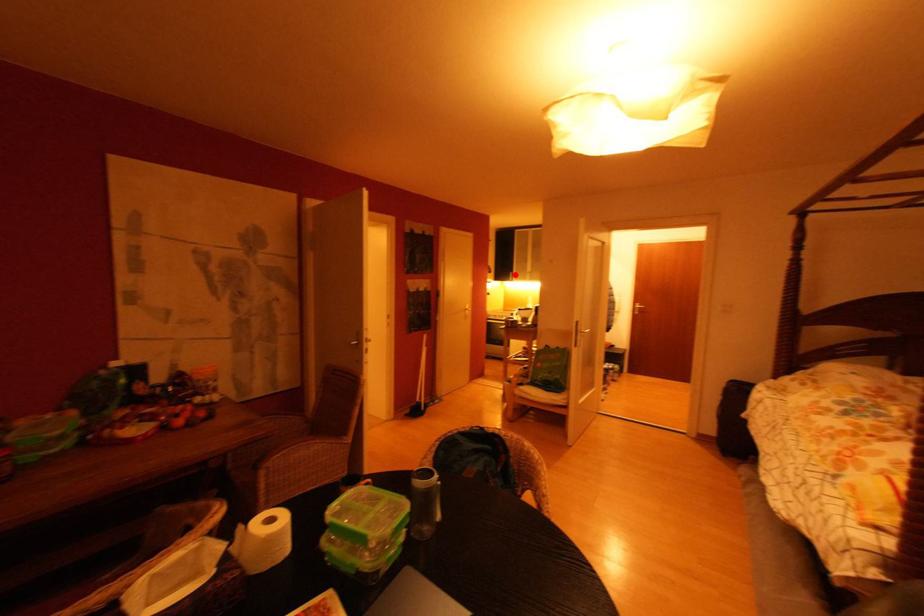
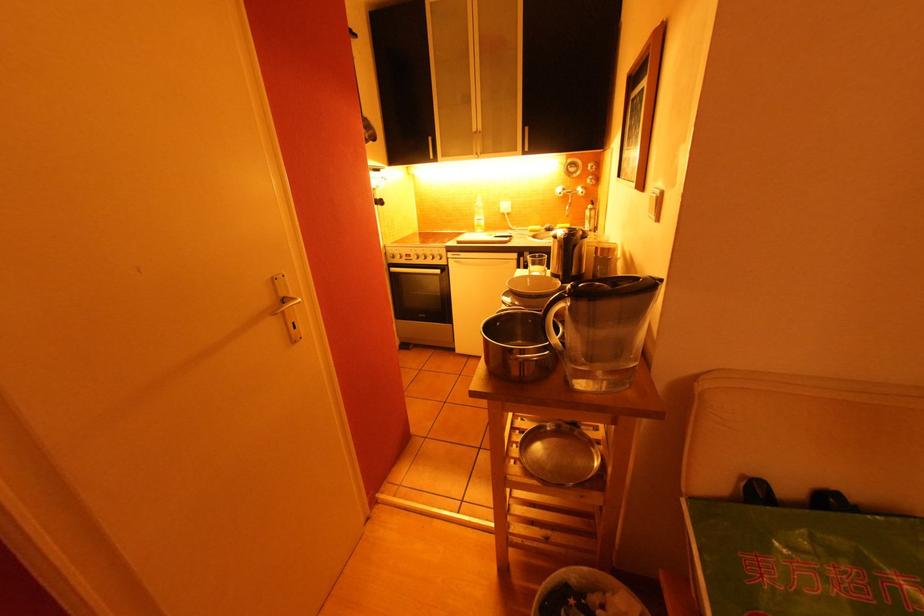
Locate, in the second image, the point that corresponds to the highlighted location in the first image.

(434, 140)